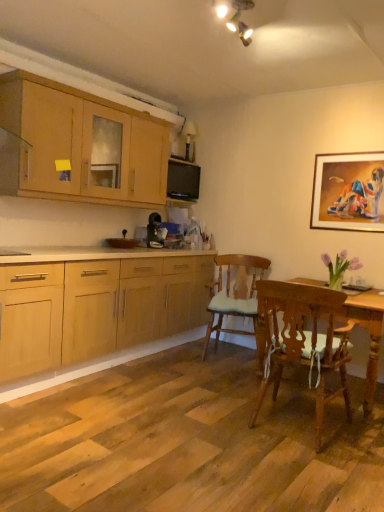
Question: From the image's perspective, relative to wooden chair with white cushion at lower right, placed as the first chair when sorted from front to back, is wooden chair with cushion at center, positioned as the 2th chair in front-to-back order, above or below?

Choices:
 (A) below
 (B) above

Answer: (B)

Question: Choose the correct answer: Is wooden chair with cushion at center, the 1th chair when ordered from back to front, inside wooden chair with white cushion at lower right, marked as the second chair in a back-to-front arrangement, or outside it?

Choices:
 (A) outside
 (B) inside

Answer: (A)

Question: Based on their relative distances, which object is nearer to the wooden chair with cushion at center, positioned as the 2th chair in front-to-back order?

Choices:
 (A) wooden chair with white cushion at lower right, placed as the first chair when sorted from front to back
 (B) light wood cabinet at upper left
 (C) gold-framed painting at upper right
 (D) black glossy microwave oven at upper center

Answer: (A)

Question: Which is nearer to the gold-framed painting at upper right?

Choices:
 (A) wooden chair with white cushion at lower right, placed as the first chair when sorted from front to back
 (B) black glossy microwave oven at upper center
 (C) light wood cabinet at upper left
 (D) wooden chair with cushion at center, the 1th chair when ordered from back to front

Answer: (D)